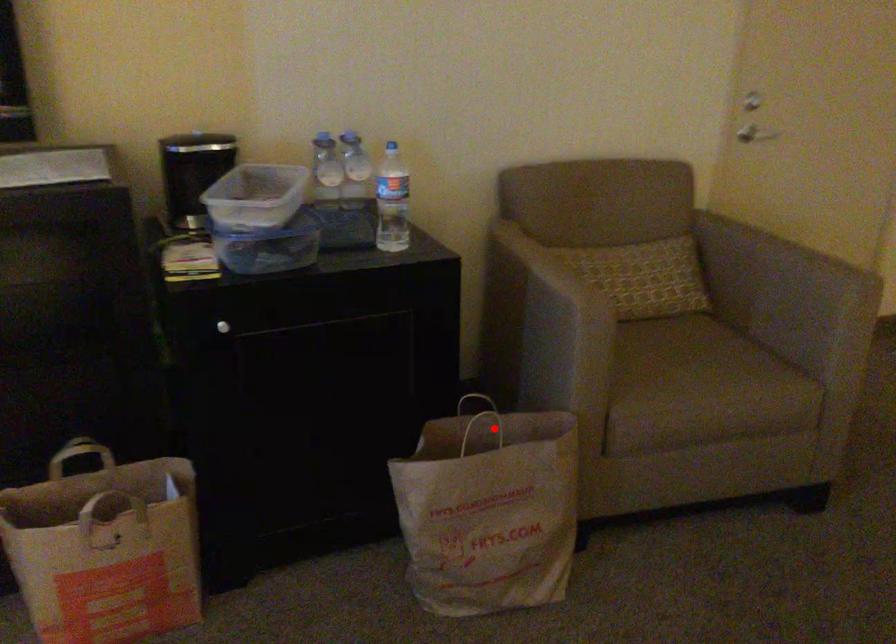
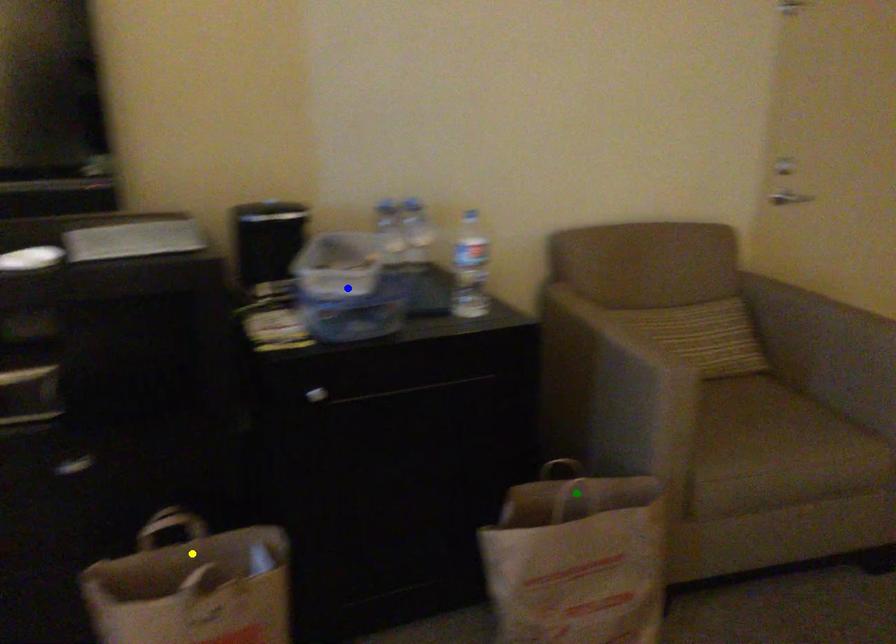
Question: I am providing you with two images of the same scene from different viewpoints. A red point is marked on the first image. You are given multiple points on the second image. Can you choose the point in image 2 that corresponds to the point in image 1?

Choices:
 (A) green point
 (B) yellow point
 (C) blue point

Answer: (A)